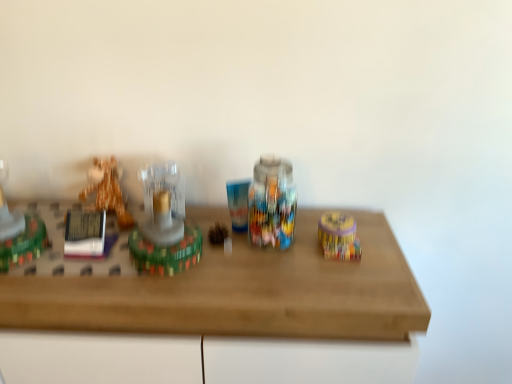
The width and height of the screenshot is (512, 384). I want to click on blank space to the left of plush orange bear at left, the 3th toy viewed from the right, so click(53, 211).